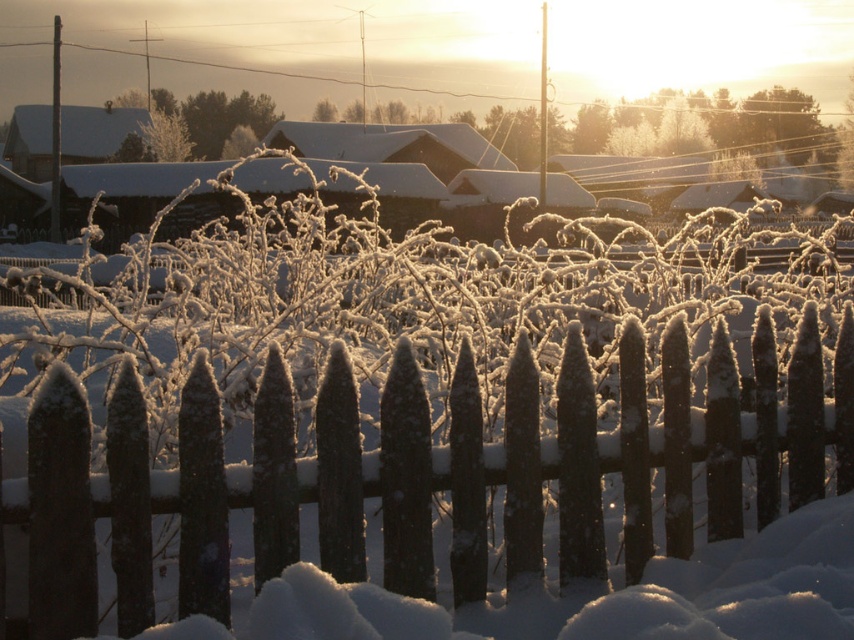
Who is shorter, smooth dark wood fence at center or matte brown wooden hut at upper left?

smooth dark wood fence at center is shorter.

Does smooth dark wood fence at center have a larger size compared to matte brown wooden hut at upper left?

Actually, smooth dark wood fence at center might be smaller than matte brown wooden hut at upper left.

Is point (547, 451) less distant than point (108, 138)?

That is True.

Find the location of a particular element. This screenshot has width=854, height=640. smooth dark wood fence at center is located at coordinates pyautogui.click(x=448, y=465).